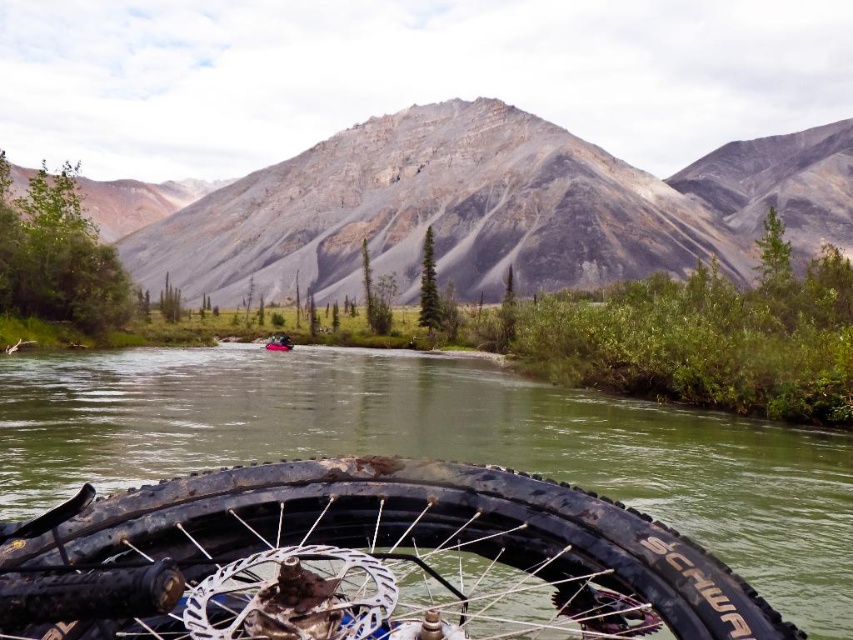
Who is positioned more to the right, rusty metal tire at bottom or rubber boat at center?

Positioned to the right is rusty metal tire at bottom.

Between point (578, 513) and point (288, 339), which one is positioned behind?

Point (288, 339)

In order to click on rusty metal tire at bottom in this screenshot , I will do `click(364, 561)`.